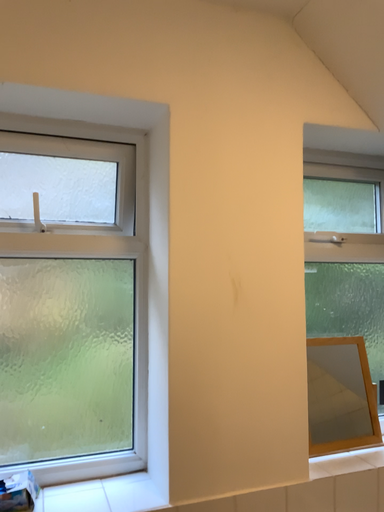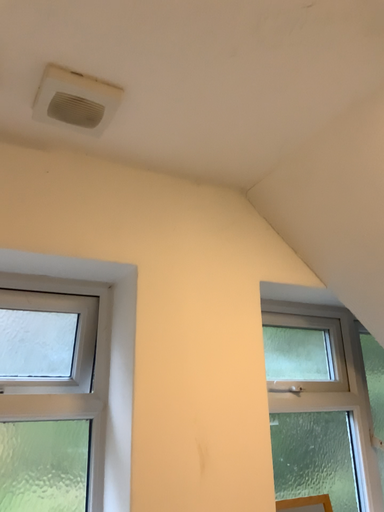
Question: How did the camera likely rotate when shooting the video?

Choices:
 (A) rotated downward
 (B) rotated upward

Answer: (B)